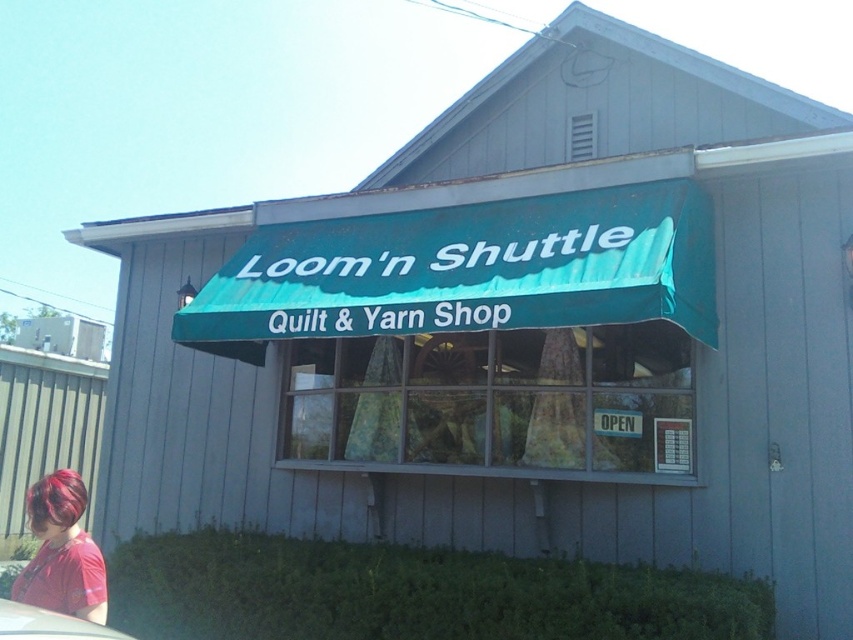
Question: Can you confirm if teal fabric awning at center is smaller than shiny red hair at lower left?

Choices:
 (A) yes
 (B) no

Answer: (B)

Question: Is the position of teal fabric awning at center less distant than that of shiny red hair at lower left?

Choices:
 (A) yes
 (B) no

Answer: (B)

Question: Can you confirm if teal fabric awning at center is positioned below shiny red hair at lower left?

Choices:
 (A) yes
 (B) no

Answer: (B)